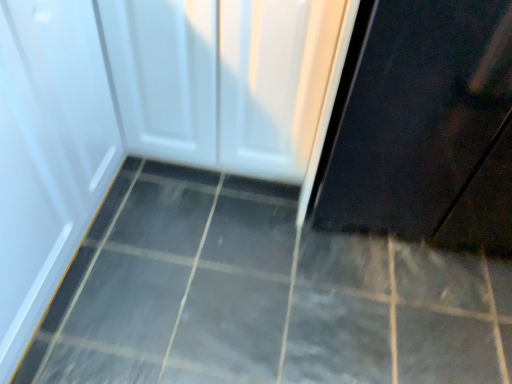
The image size is (512, 384). Identify the location of white glossy cabinet at upper left. (222, 79).

What do you see at coordinates (222, 79) in the screenshot? Image resolution: width=512 pixels, height=384 pixels. I see `white glossy cabinet at upper left` at bounding box center [222, 79].

Image resolution: width=512 pixels, height=384 pixels. Find the location of `white glossy cabinet at upper left`. white glossy cabinet at upper left is located at coordinates (222, 79).